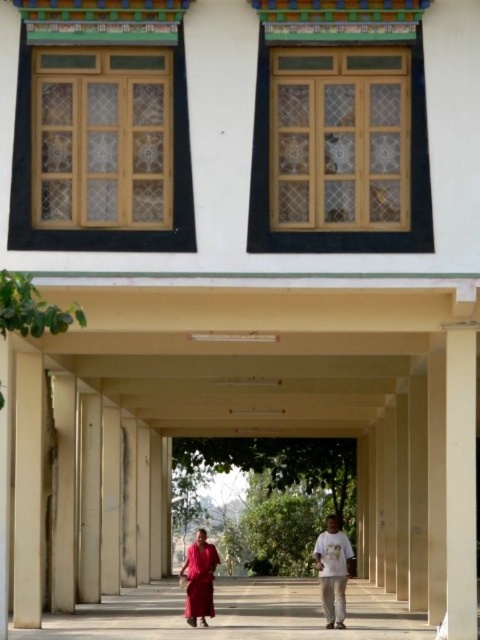
You are standing in the walkway of the building and see both the white cotton shirt at lower center and the matte red dress at lower center. Which clothing item is closer to the ceiling of the walkway?

The white cotton shirt at lower center is located above the matte red dress at lower center, so it is closer to the ceiling of the walkway.

You are standing at the entrance of the building and want to reach the smooth concrete walkway at center. Which direction should you move in relative to the building?

The smooth concrete walkway at center is located at point 0.959 on the x axis and 0.492 on the y axis, so you should move towards the center of the building to reach it.

You are standing in front of the building and want to determine the relative positions of two points marked on the walkway. Which point is closer to you, point 1 at coordinates (314, 593) or point 2 at coordinates (339, 627)?

Point 1 at coordinates (314, 593) is closer to you because it is further to the viewer than point 2 at coordinates (339, 627).